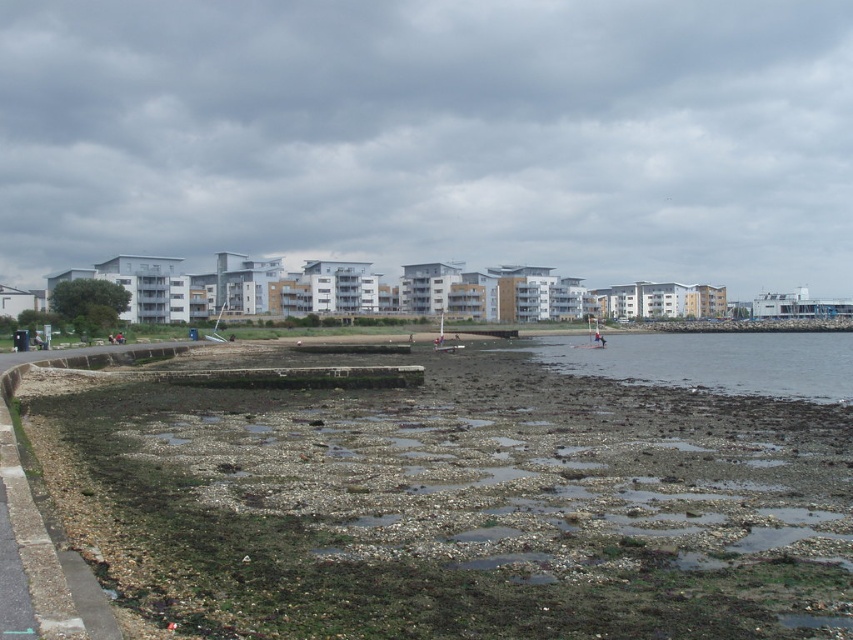
Question: Does rough stone beach at center come behind brown rocky water at lower center?

Choices:
 (A) no
 (B) yes

Answer: (A)

Question: Is rough stone beach at center bigger than brown rocky water at lower center?

Choices:
 (A) yes
 (B) no

Answer: (B)

Question: Does rough stone beach at center have a lesser width compared to brown rocky water at lower center?

Choices:
 (A) no
 (B) yes

Answer: (B)

Question: Which of the following is the farthest from the observer?

Choices:
 (A) brown rocky water at lower center
 (B) rough stone beach at center

Answer: (A)